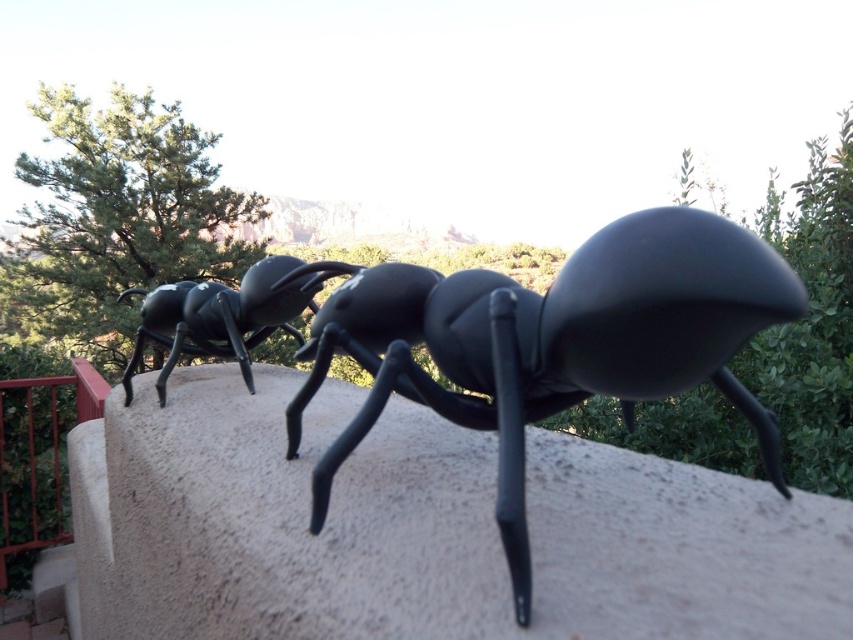
You are an art curator planning to install a protective glass panel over the two ant sculptures. The panel must cover both the glossy black ant at center and the matte black ant at center without any overlap. What is the minimum length required for the panel in inches?

The minimum length required for the panel must be at least 6.45 inches to cover both the glossy black ant at center and the matte black ant at center without overlapping, as they are spaced 6.45 inches apart.

You are standing in front of the sculpture installation and want to take a photo that includes both the glossy black ant at center and the matte black ant at center. Which one should you position to your left to ensure both are in the frame?

You should position the matte black ant at center to your left because the glossy black ant at center is to the right of it, ensuring both are included in the frame.